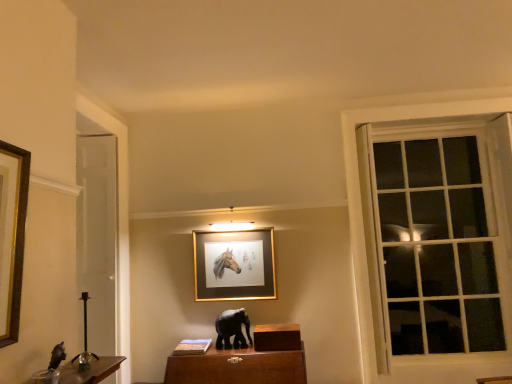
Question: Considering the positions of shiny black elephant at left, positioned as the 2th animal in back-to-front order, and white glass window at right in the image, is shiny black elephant at left, positioned as the 2th animal in back-to-front order, wider or thinner than white glass window at right?

Choices:
 (A) wide
 (B) thin

Answer: (A)

Question: Does point (62, 354) appear closer or farther from the camera than point (483, 259)?

Choices:
 (A) closer
 (B) farther

Answer: (A)

Question: Which is nearer to the gold/metallic picture frame at center?

Choices:
 (A) white glass window at right
 (B) black glossy elephant at center, the second animal positioned from the top
 (C) shiny black elephant at left, the 1th animal in the top-to-bottom sequence

Answer: (B)

Question: Estimate the real-world distances between objects in this image. Which object is closer to the white glass window at right?

Choices:
 (A) shiny black elephant at left, the 2th animal when ordered from right to left
 (B) black glossy elephant at center, which is the 2th animal from front to back
 (C) gold/metallic picture frame at center

Answer: (C)